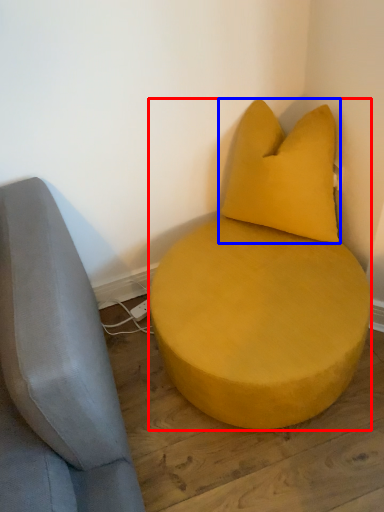
Question: Which point is closer to the camera, furniture (highlighted by a red box) or pillow (highlighted by a blue box)?

Choices:
 (A) furniture
 (B) pillow

Answer: (A)